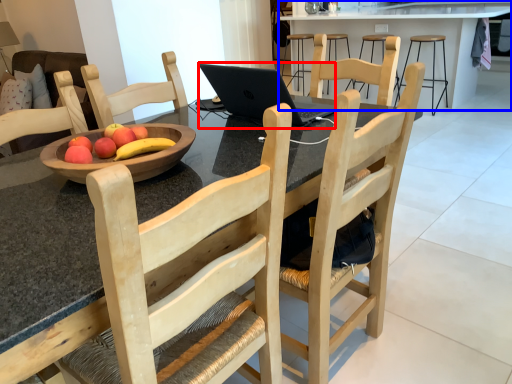
Question: Among these objects, which one is nearest to the camera, laptop (highlighted by a red box) or table (highlighted by a blue box)?

Choices:
 (A) laptop
 (B) table

Answer: (A)